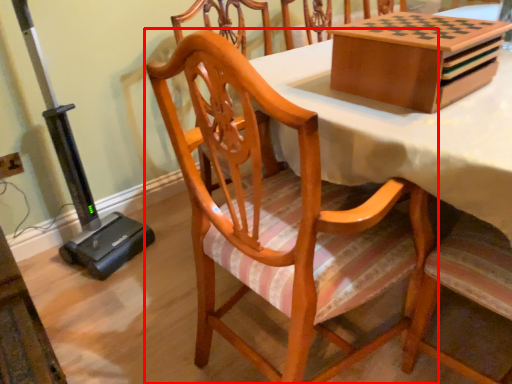
Question: From the image's perspective, where is chair (annotated by the red box) located relative to cardboard box?

Choices:
 (A) above
 (B) below

Answer: (B)